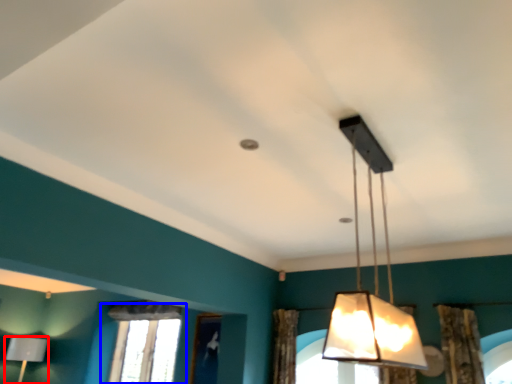
Question: Among these objects, which one is farthest to the camera, lamp (highlighted by a red box) or window (highlighted by a blue box)?

Choices:
 (A) lamp
 (B) window

Answer: (A)